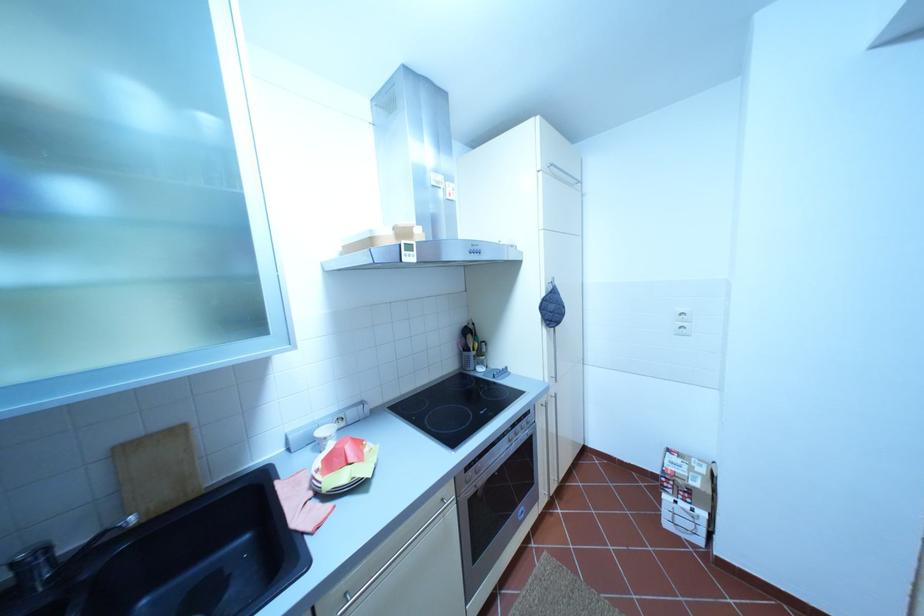
Where would you pull the tall cabinet handle? Please return your answer as a coordinate pair (x, y).

(565, 174)